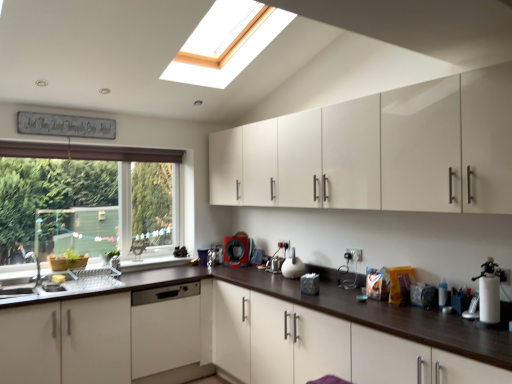
Question: From the image's perspective, relative to green matte window at left, is black plastic coffee machine at center above or below?

Choices:
 (A) above
 (B) below

Answer: (B)

Question: Looking at their shapes, would you say black plastic coffee machine at center is wider or thinner than green matte window at left?

Choices:
 (A) thin
 (B) wide

Answer: (B)

Question: Which of these objects is positioned closest to the white glossy cabinets at center, positioned as the first cabinetry in bottom-to-top order?

Choices:
 (A) glossy white cabinets at upper center, placed as the 2th cabinetry when sorted from bottom to top
 (B) white glossy sink at lower left
 (C) green matte window at left
 (D) black plastic coffee machine at center
 (E) white matte dishwasher at center

Answer: (E)

Question: Which of these objects is positioned farthest from the glossy white cabinets at upper center, placed as the 2th cabinetry when sorted from bottom to top?

Choices:
 (A) white glossy cabinets at center, positioned as the first cabinetry in bottom-to-top order
 (B) green matte window at left
 (C) white glossy sink at lower left
 (D) black plastic coffee machine at center
 (E) white matte dishwasher at center

Answer: (C)